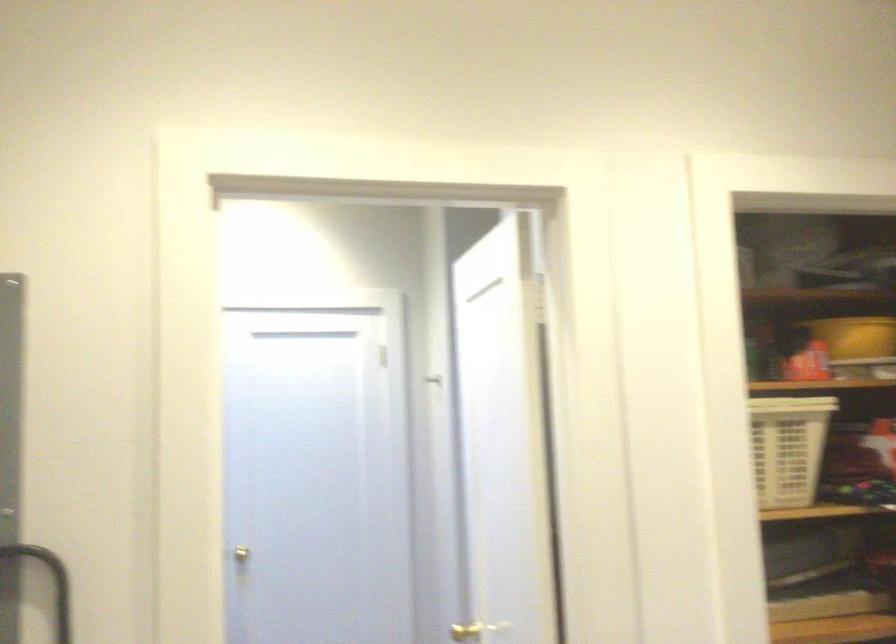
Where would you lift the yellow container? Please return your answer as a coordinate pair (x, y).

(855, 337)